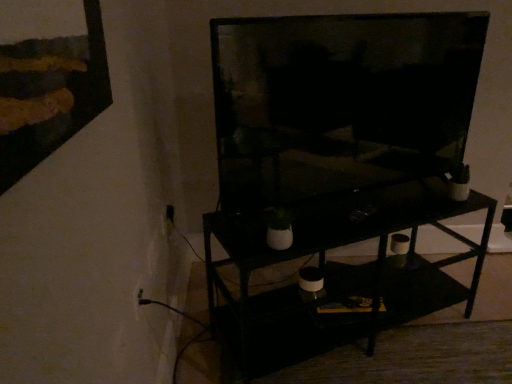
Question: From a real-world perspective, is black matte shelf at center located beneath matte black tv at center?

Choices:
 (A) no
 (B) yes

Answer: (B)

Question: Would you say matte black tv at center is part of black matte shelf at center's contents?

Choices:
 (A) yes
 (B) no

Answer: (B)

Question: Is black matte shelf at center outside matte black tv at center?

Choices:
 (A) yes
 (B) no

Answer: (A)

Question: From the image's perspective, is black matte shelf at center above matte black tv at center?

Choices:
 (A) yes
 (B) no

Answer: (B)

Question: Would you consider black matte shelf at center to be distant from matte black tv at center?

Choices:
 (A) no
 (B) yes

Answer: (A)

Question: Is white plastic electric outlet at lower left in front of or behind matte black tv at center in the image?

Choices:
 (A) front
 (B) behind

Answer: (B)

Question: Would you say white plastic electric outlet at lower left is to the left or to the right of matte black tv at center in the picture?

Choices:
 (A) right
 (B) left

Answer: (B)

Question: From a real-world perspective, is white plastic electric outlet at lower left positioned above or below matte black tv at center?

Choices:
 (A) above
 (B) below

Answer: (B)

Question: Is point (138, 319) positioned closer to the camera than point (278, 198)?

Choices:
 (A) farther
 (B) closer

Answer: (B)

Question: Is black matte shelf at center bigger or smaller than matte black tv at center?

Choices:
 (A) small
 (B) big

Answer: (B)

Question: In terms of height, does black matte shelf at center look taller or shorter compared to matte black tv at center?

Choices:
 (A) tall
 (B) short

Answer: (B)

Question: Does point (445, 286) appear closer or farther from the camera than point (343, 74)?

Choices:
 (A) closer
 (B) farther

Answer: (B)

Question: From the image's perspective, is black matte shelf at center positioned above or below matte black tv at center?

Choices:
 (A) below
 (B) above

Answer: (A)

Question: In terms of width, does white plastic electric outlet at lower left look wider or thinner when compared to black matte shelf at center?

Choices:
 (A) thin
 (B) wide

Answer: (A)

Question: Considering their positions, is white plastic electric outlet at lower left located in front of or behind black matte shelf at center?

Choices:
 (A) behind
 (B) front

Answer: (B)